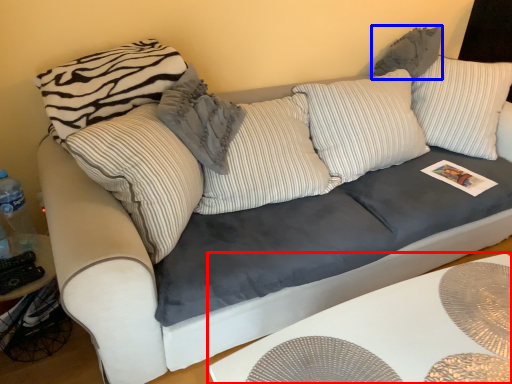
Question: Which point is further to the camera, table (highlighted by a red box) or pillow (highlighted by a blue box)?

Choices:
 (A) table
 (B) pillow

Answer: (B)